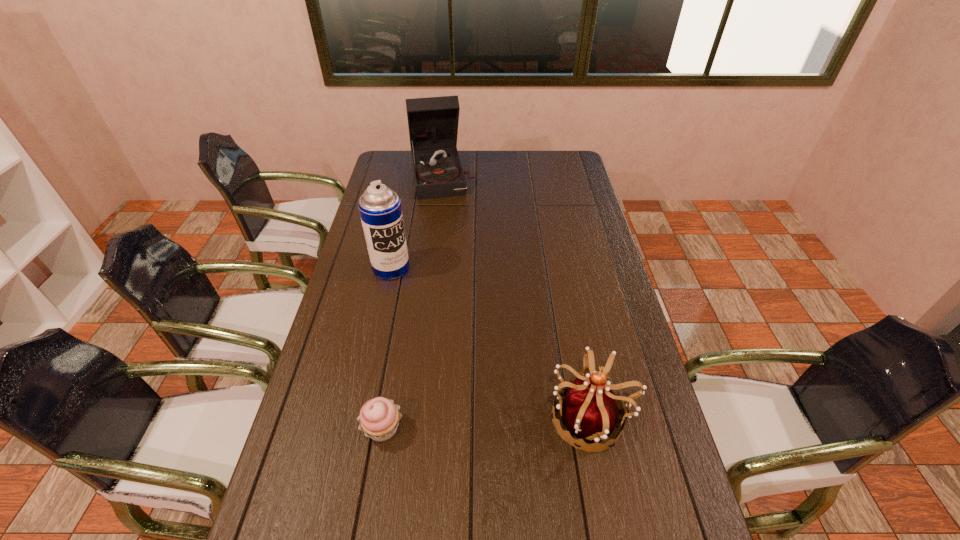
Locate an element on the screen. blank region between the rightmost object and the cupcake is located at coordinates (487, 423).

Where is `vacant point located between the cupcake and the phonograph_record`? Image resolution: width=960 pixels, height=540 pixels. vacant point located between the cupcake and the phonograph_record is located at coordinates (413, 302).

At what (x,y) coordinates should I click in order to perform the action: click on free space between the aerosol can and the rightmost object. Please return your answer as a coordinate pair (x, y). The height and width of the screenshot is (540, 960). Looking at the image, I should click on (491, 342).

Identify the location of vacant area that lies between the farthest object and the third tallest object. (516, 296).

This screenshot has width=960, height=540. I want to click on free spot between the tiara and the farthest object, so click(x=516, y=296).

Image resolution: width=960 pixels, height=540 pixels. In order to click on free area in between the third nearest object and the shortest object in this screenshot , I will do `click(387, 348)`.

Select which object appears as the second closest to the phonograph_record. Please provide its 2D coordinates. Your answer should be formatted as a tuple, i.e. [(x, y)], where the tuple contains the x and y coordinates of a point satisfying the conditions above.

[(590, 410)]

Select which object appears as the closest to the tiara. Please provide its 2D coordinates. Your answer should be formatted as a tuple, i.e. [(x, y)], where the tuple contains the x and y coordinates of a point satisfying the conditions above.

[(379, 418)]

The height and width of the screenshot is (540, 960). In order to click on vacant space that satisfies the following two spatial constraints: 1. on the back side of the farthest object; 2. on the right side of the shortest object in this screenshot , I will do `click(425, 176)`.

Where is `blank area in the image that satisfies the following two spatial constraints: 1. on the back side of the phonograph_record; 2. on the left side of the cupcake`? The image size is (960, 540). blank area in the image that satisfies the following two spatial constraints: 1. on the back side of the phonograph_record; 2. on the left side of the cupcake is located at coordinates (425, 176).